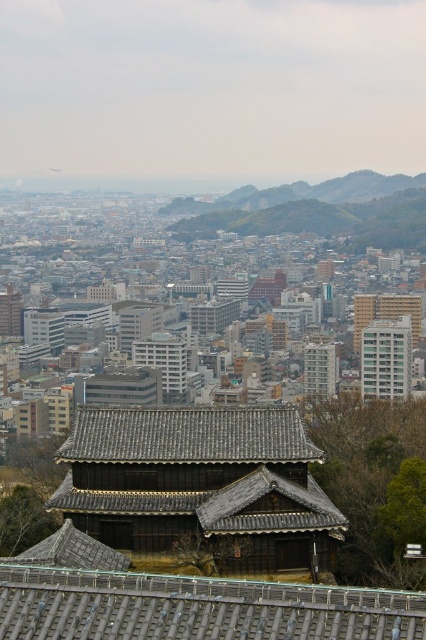
You are standing in the city and want to take a photo of both the matte brown wooden temple at center and the white glossy building at upper right. Which one should you focus on first to ensure both are in sharp focus?

You should focus on the matte brown wooden temple at center first since it is closer to the viewer than the white glossy building at upper right, ensuring both will be in focus when using depth of field appropriately.

You are an architect analyzing the cityscape image. You notice two points marked in the scene. Which of the two points, point (230, 445) or point (368, 294), is nearer to your viewpoint?

Point (230, 445) is closer to the camera than point (368, 294).

You are a tourist standing in front of the matte brown wooden temple at center and the white glossy building at upper right. Which of these two structures is located to the right when facing the cityscape?

The white glossy building at upper right is located to the right of the matte brown wooden temple at center.